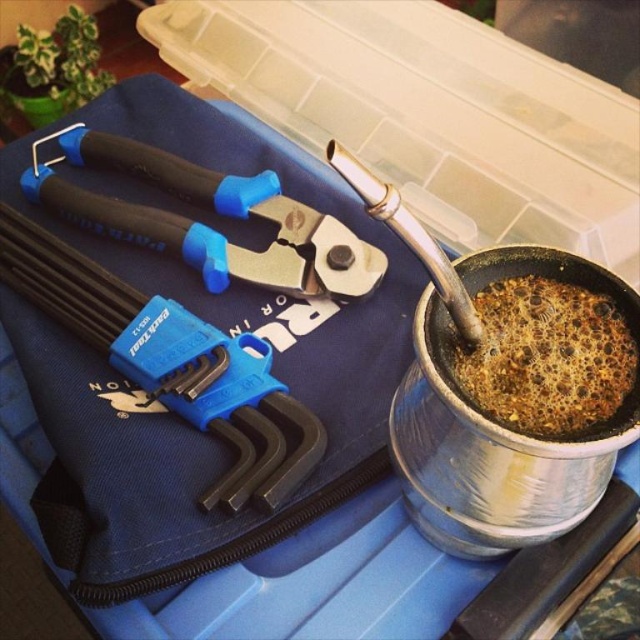
You are organizing a tool kit and need to stack items vertically. Given the height difference between the blue plastic hex key set at upper left and the brown matte coffee at right, which item should you place at the bottom to ensure stability?

The blue plastic hex key set at upper left is much taller than the brown matte coffee at right, so placing the taller hex key set at the bottom would provide better stability due to its height and base area.

You are a photographer trying to capture a closeup of the blue plastic hex key set at upper left. Given that you are currently 1.01 meters away from it, can you move closer to get a better shot?

The distance between you and the blue plastic hex key set at upper left is 1.01 meters. To get a better closeup, you would need to move closer than that distance.